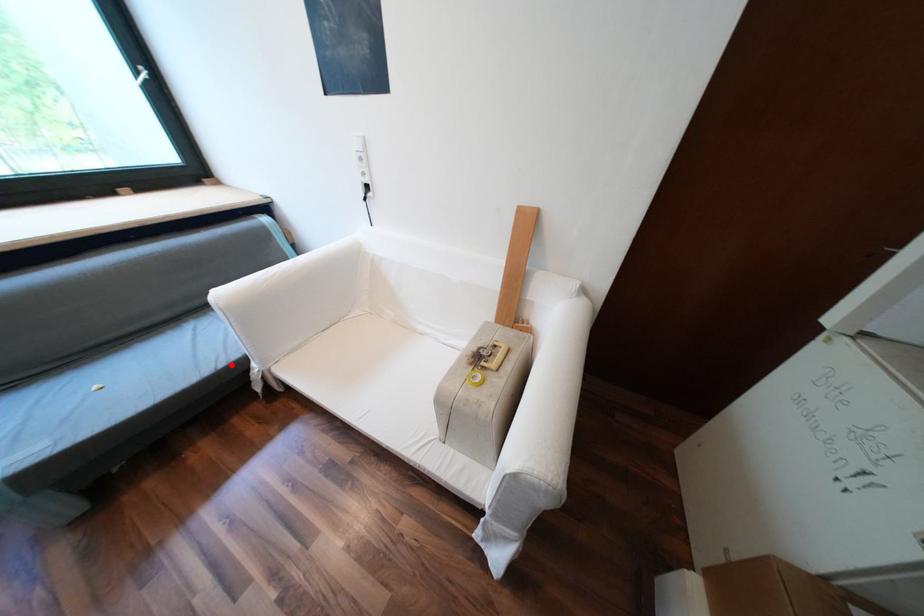
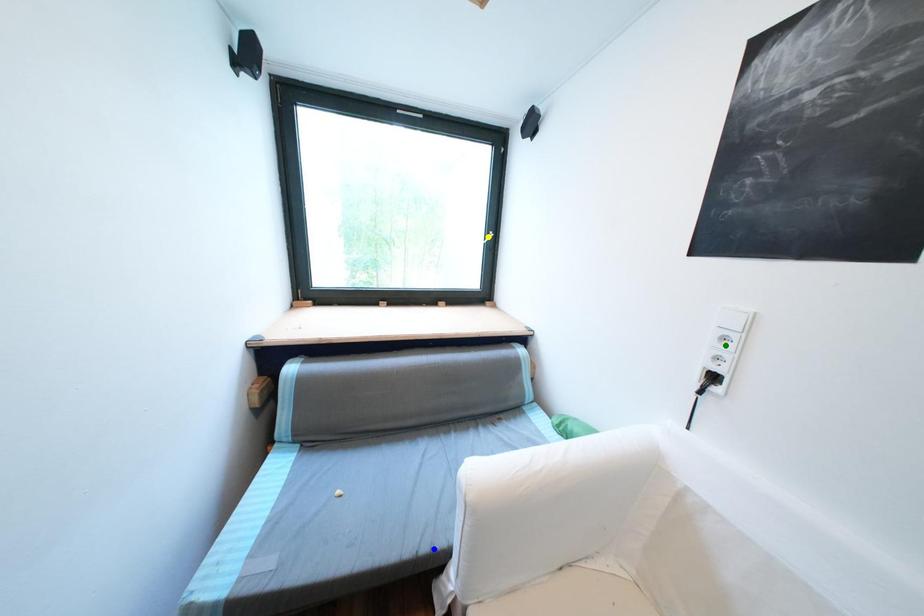
Question: I am providing you with two images of the same scene from different viewpoints. A red point is marked on the first image. You are given multiple points on the second image. Can you choose the point in image 2 that corresponds to the point in image 1?

Choices:
 (A) blue point
 (B) green point
 (C) yellow point

Answer: (A)